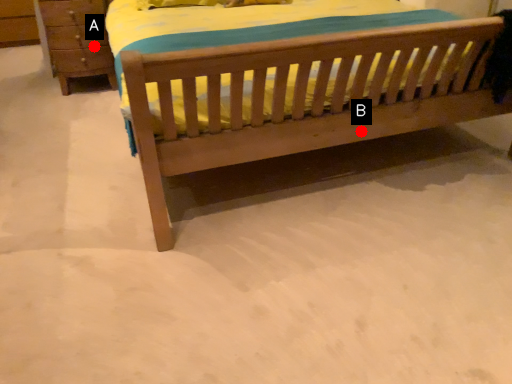
Question: Two points are circled on the image, labeled by A and B beside each circle. Among these points, which one is nearest to the camera?

Choices:
 (A) A is closer
 (B) B is closer

Answer: (B)